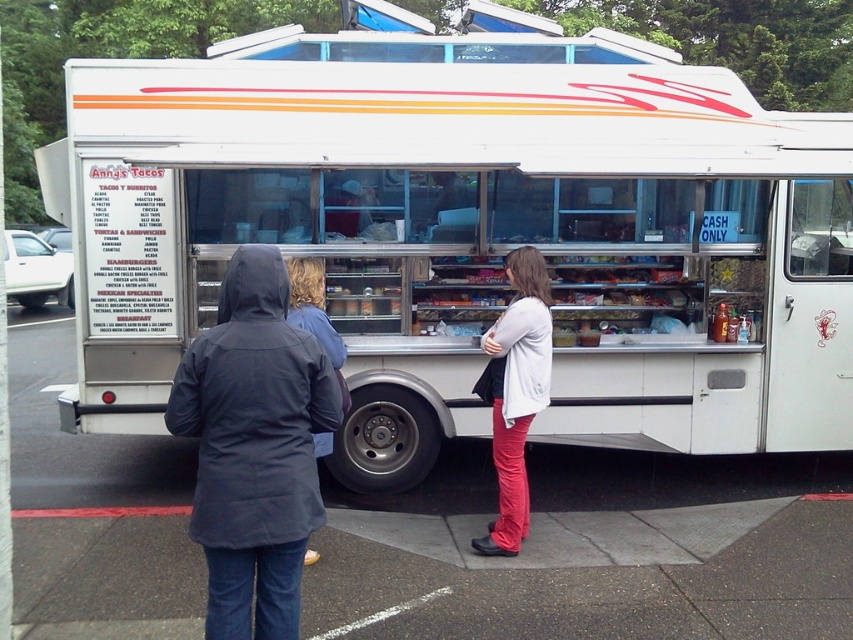
Can you confirm if dark blue hooded jacket at left is wider than matte white sweater at center?

Yes.

This screenshot has height=640, width=853. Identify the location of dark blue hooded jacket at left. (254, 445).

Is point (265, 458) less distant than point (544, 301)?

Yes.

Locate an element on the screen. dark blue hooded jacket at left is located at coordinates (254, 445).

Based on the photo, between white metallic food truck at center and dark blue hooded jacket at left, which one is positioned lower?

dark blue hooded jacket at left is lower down.

Which is in front, point (518, 228) or point (281, 273)?

Point (281, 273)

What do you see at coordinates (469, 234) in the screenshot?
I see `white metallic food truck at center` at bounding box center [469, 234].

Where is `white metallic food truck at center`? This screenshot has height=640, width=853. white metallic food truck at center is located at coordinates (469, 234).

Is dark blue hooded jacket at left above dark blue hooded jacket at center?

No, dark blue hooded jacket at left is not above dark blue hooded jacket at center.

Between dark blue hooded jacket at left and dark blue hooded jacket at center, which one appears on the left side from the viewer's perspective?

dark blue hooded jacket at center

Between point (293, 628) and point (345, 356), which one is positioned behind?

Positioned behind is point (345, 356).

Identify the location of dark blue hooded jacket at left. (254, 445).